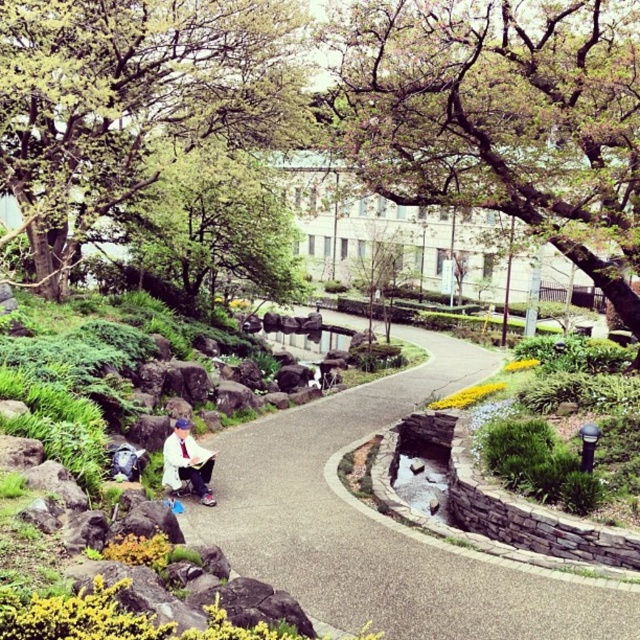
Is green leafy tree at upper center to the right of white fabric shirt at center from the viewer's perspective?

Yes, green leafy tree at upper center is to the right of white fabric shirt at center.

Between point (564, 212) and point (189, 458), which one is positioned behind?

The point (564, 212) is more distant.

Who is more distant from viewer, [365,173] or [172,465]?

The point [365,173] is behind.

You are a GUI agent. You are given a task and a screenshot of the screen. Output one action in this format:
    pyautogui.click(x=<x>, y=<y>)
    Task: Click on the green leafy tree at upper center
    The height and width of the screenshot is (640, 640).
    Given the screenshot: What is the action you would take?
    pyautogui.click(x=499, y=116)

Describe the element at coordinates (499, 116) in the screenshot. Image resolution: width=640 pixels, height=640 pixels. I see `green leafy tree at upper center` at that location.

Which is above, green leafy tree at upper center or concrete pathway at center?

green leafy tree at upper center

You are a GUI agent. You are given a task and a screenshot of the screen. Output one action in this format:
    pyautogui.click(x=<x>, y=<y>)
    Task: Click on the green leafy tree at upper center
    This screenshot has height=640, width=640.
    Given the screenshot: What is the action you would take?
    pyautogui.click(x=499, y=116)

At what (x,y) coordinates should I click in order to perform the action: click on green leafy tree at upper center. Please return your answer as a coordinate pair (x, y). Looking at the image, I should click on (499, 116).

Consider the image. Is green leafy tree at upper left shorter than green leafy tree at center?

Correct, green leafy tree at upper left is not as tall as green leafy tree at center.

Which is above, green leafy tree at upper left or green leafy tree at center?

green leafy tree at upper left

Consider the image. Measure the distance between green leafy tree at upper left and camera.

They are 69.37 feet apart.

You are a GUI agent. You are given a task and a screenshot of the screen. Output one action in this format:
    pyautogui.click(x=<x>, y=<y>)
    Task: Click on the green leafy tree at upper left
    
    Given the screenshot: What is the action you would take?
    pyautogui.click(x=132, y=100)